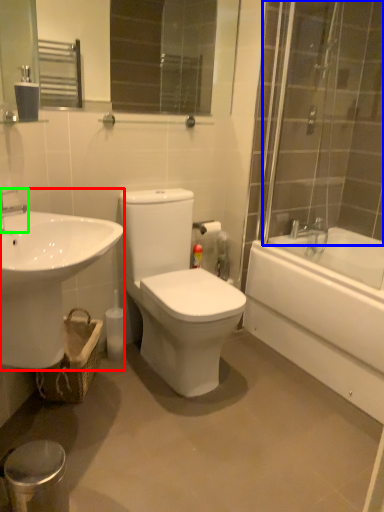
Question: Which is nearer to the sink (highlighted by a red box)? shower door (highlighted by a blue box) or tap (highlighted by a green box).

Choices:
 (A) shower door
 (B) tap

Answer: (B)